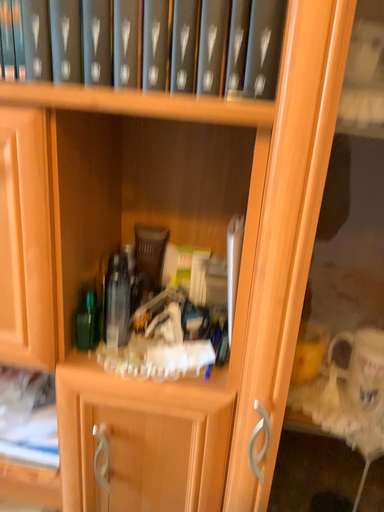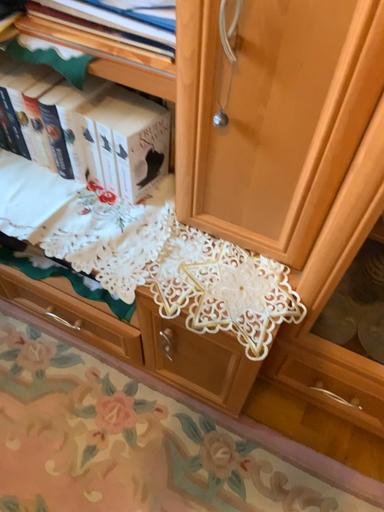
Question: How did the camera likely rotate when shooting the video?

Choices:
 (A) rotated right
 (B) rotated left

Answer: (B)